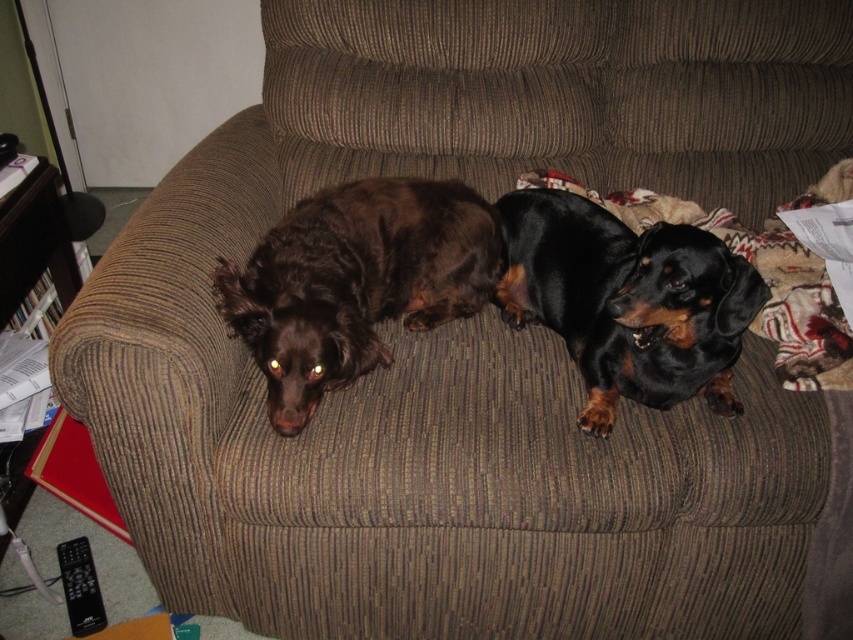
You are standing in front of the couch with two dogs. You see two points marked on the couch. Which point is closer to you, point (311,298) or point (634,280)?

Point (311,298) is closer to you because it is further to the viewer than point (634,280).

You are a photographer trying to capture a closeup shot of both the shiny brown dog at center and the black shiny dog at center. Since you want both dogs to be in the frame, which dog should you position closer to the left side of the camera?

The shiny brown dog at center should be positioned closer to the left side of the camera since it is already to the left of the black shiny dog at center in the image.

You are a dog groomer who needs to fit both dogs into a single pet carrier that can only accommodate a total width of 80 cm. Given that the shiny brown dog at center is wider than the black shiny dog at center, can both dogs fit side by side in the carrier?

The shiny brown dog at center is wider than the black shiny dog at center. However, without knowing their exact widths, it is impossible to determine if their combined width exceeds 80 cm. Additional measurements are needed.